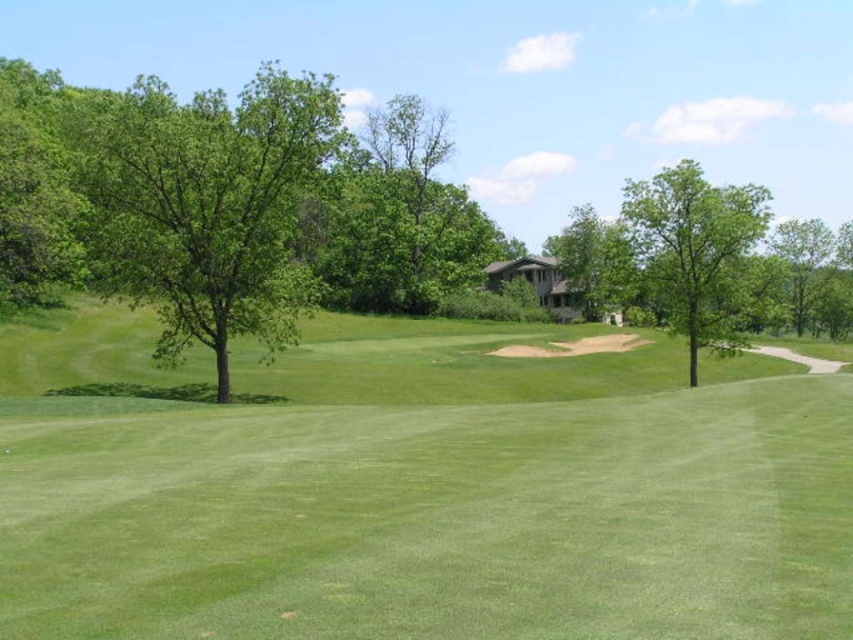
Question: Based on their relative distances, which object is nearer to the green leafy tree at center?

Choices:
 (A) green leafy tree at upper right
 (B) green leafy tree at right

Answer: (B)

Question: Can you confirm if green leafy tree at left is wider than green leafy tree at right?

Choices:
 (A) no
 (B) yes

Answer: (A)

Question: Which object is closer to the camera taking this photo?

Choices:
 (A) green grassy field at center
 (B) green leafy tree at upper right

Answer: (A)

Question: Which object appears closest to the camera in this image?

Choices:
 (A) green leafy tree at left
 (B) green grassy field at center

Answer: (B)

Question: Does green grassy field at center have a lesser width compared to green leafy tree at upper right?

Choices:
 (A) yes
 (B) no

Answer: (A)

Question: From the image, what is the correct spatial relationship of green leafy tree at center in relation to green leafy tree at upper right?

Choices:
 (A) above
 (B) below

Answer: (A)